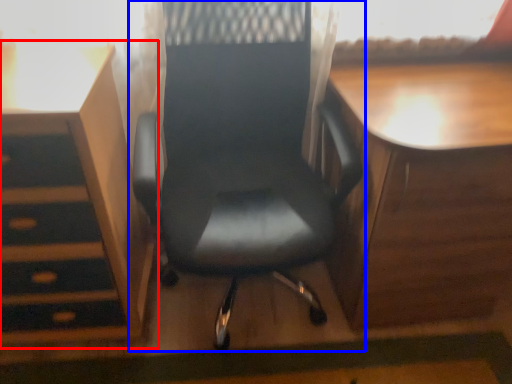
Question: Which object is closer to the camera taking this photo, vanity (highlighted by a red box) or chair (highlighted by a blue box)?

Choices:
 (A) vanity
 (B) chair

Answer: (B)